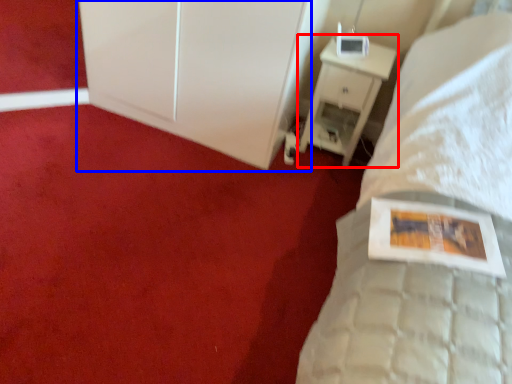
Question: Among these objects, which one is farthest to the camera, nightstand (highlighted by a red box) or dresser (highlighted by a blue box)?

Choices:
 (A) nightstand
 (B) dresser

Answer: (A)